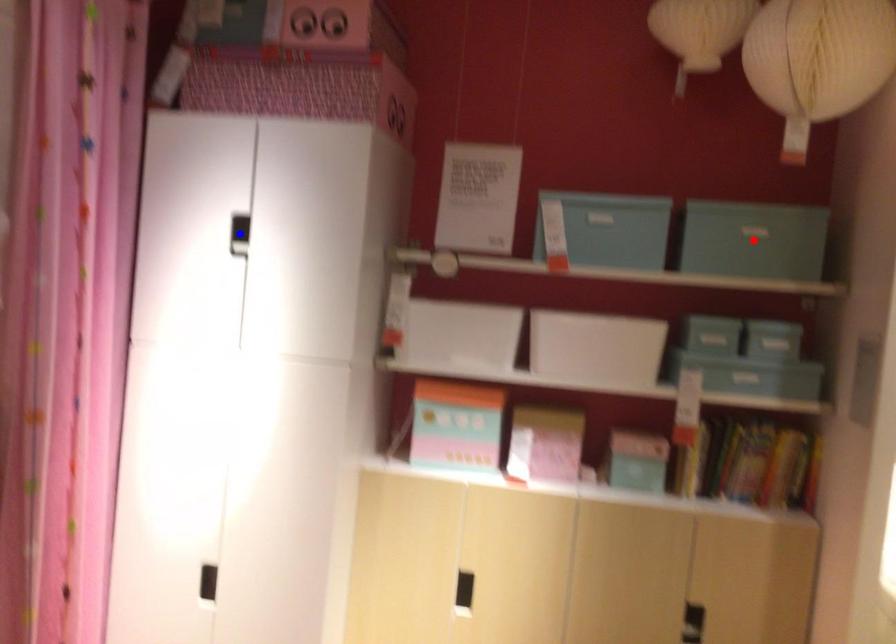
Question: In the image, two points are highlighted. Which point is nearer to the camera? Reply with the corresponding letter.

Choices:
 (A) blue point
 (B) red point

Answer: (B)